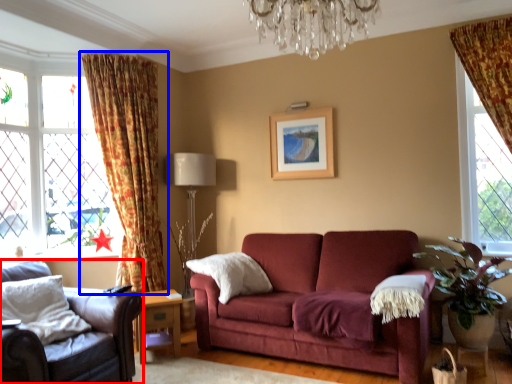
Question: Which point is further to the camera, chair (highlighted by a red box) or curtain (highlighted by a blue box)?

Choices:
 (A) chair
 (B) curtain

Answer: (B)